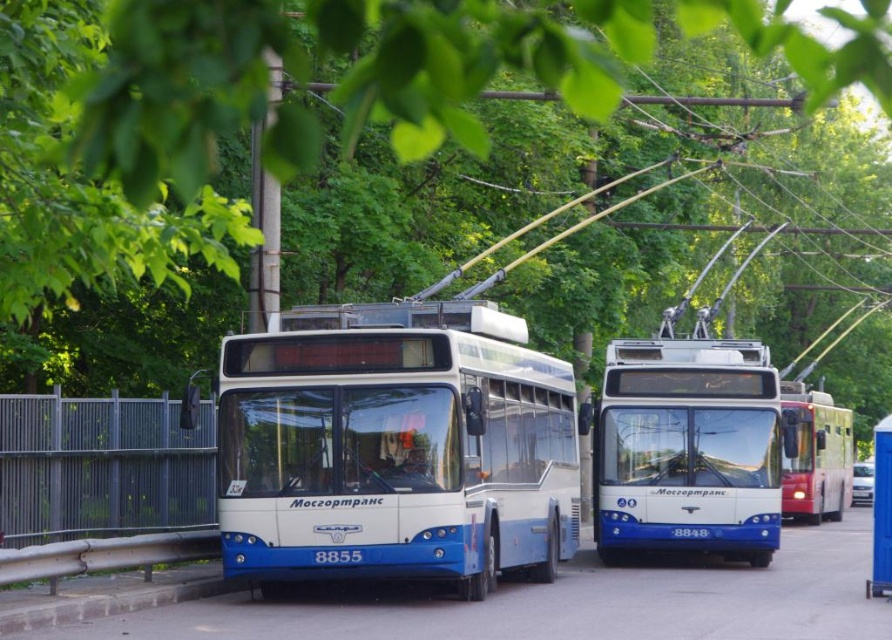
Question: Which object is closer to the camera taking this photo?

Choices:
 (A) blue metallic bus at center
 (B) blue glossy trolleybus at center

Answer: (A)

Question: Does blue glossy trolleybus at center appear on the left side of red glossy trolleybus at right?

Choices:
 (A) yes
 (B) no

Answer: (A)

Question: Which of these objects is positioned closest to the red glossy trolleybus at right?

Choices:
 (A) blue metallic bus at center
 (B) blue plastic bus stop at lower right

Answer: (B)

Question: Estimate the real-world distances between objects in this image. Which object is closer to the blue plastic bus stop at lower right?

Choices:
 (A) red glossy trolleybus at right
 (B) blue metallic bus at center
 (C) blue glossy trolleybus at center

Answer: (C)

Question: Does blue metallic bus at center appear over red glossy trolleybus at right?

Choices:
 (A) no
 (B) yes

Answer: (B)

Question: Does red glossy trolleybus at right have a lesser width compared to blue plastic bus stop at lower right?

Choices:
 (A) no
 (B) yes

Answer: (B)